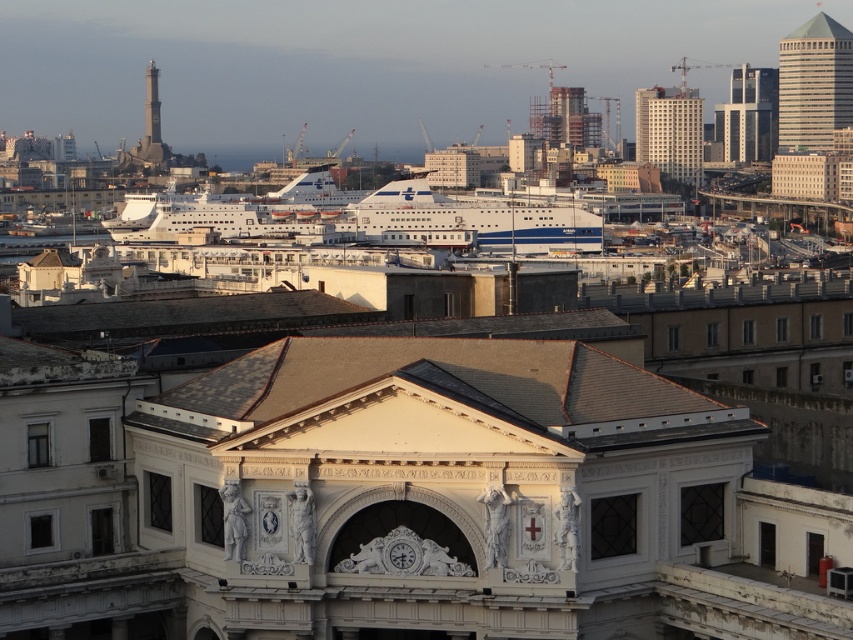
You are a photographer standing on the dock and want to capture both the white glossy cruise ship at center and the glassy white skyscraper at upper right in the same frame. Based on their positions, will the cruise ship block the view of the skyscraper?

The white glossy cruise ship at center is in front of the glassy white skyscraper at upper right, so the cruise ship will block the view of the skyscraper in the photo.